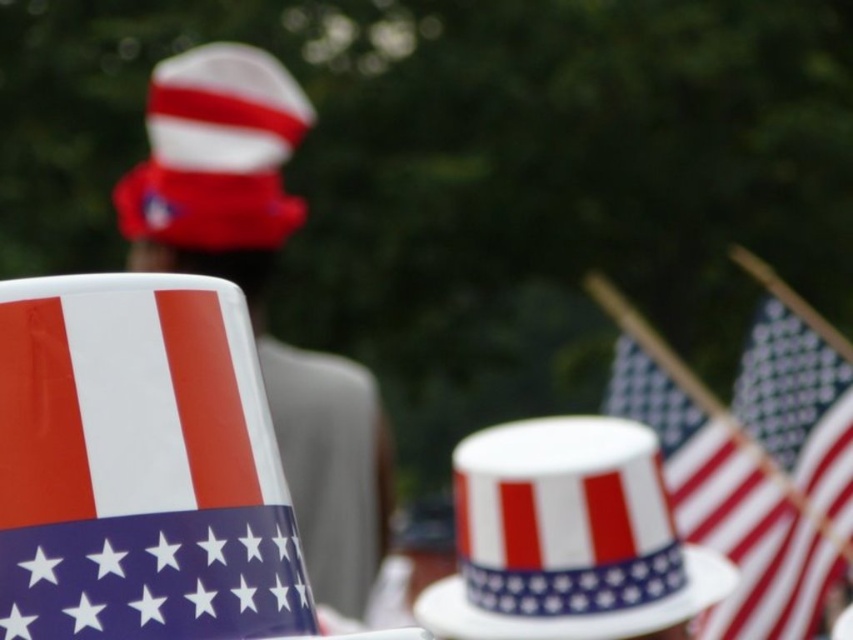
Between porcelain cup with american flag design at left and polka dot fabric flag at center, which one appears on the right side from the viewer's perspective?

polka dot fabric flag at center is more to the right.

How distant is porcelain cup with american flag design at left from polka dot fabric flag at center?

porcelain cup with american flag design at left and polka dot fabric flag at center are 2.44 meters apart from each other.

Find the location of a particular element. Image resolution: width=853 pixels, height=640 pixels. porcelain cup with american flag design at left is located at coordinates (138, 465).

Does porcelain cup with american flag design at left lie behind red and white striped hat at upper left?

No, porcelain cup with american flag design at left is in front of red and white striped hat at upper left.

Is point (271, 429) positioned behind point (252, 227)?

No, (271, 429) is closer to viewer.

Who is more distant from viewer, [137,374] or [270,234]?

The point [270,234] is behind.

Where is `porcelain cup with american flag design at left`? porcelain cup with american flag design at left is located at coordinates (138, 465).

Who is positioned more to the right, matte white hat with red, white, and blue stripes at center or red and white striped hat at upper left?

Positioned to the right is matte white hat with red, white, and blue stripes at center.

Can you confirm if matte white hat with red, white, and blue stripes at center is wider than red and white striped hat at upper left?

No, matte white hat with red, white, and blue stripes at center is not wider than red and white striped hat at upper left.

Where is `matte white hat with red, white, and blue stripes at center`? Image resolution: width=853 pixels, height=640 pixels. matte white hat with red, white, and blue stripes at center is located at coordinates (567, 538).